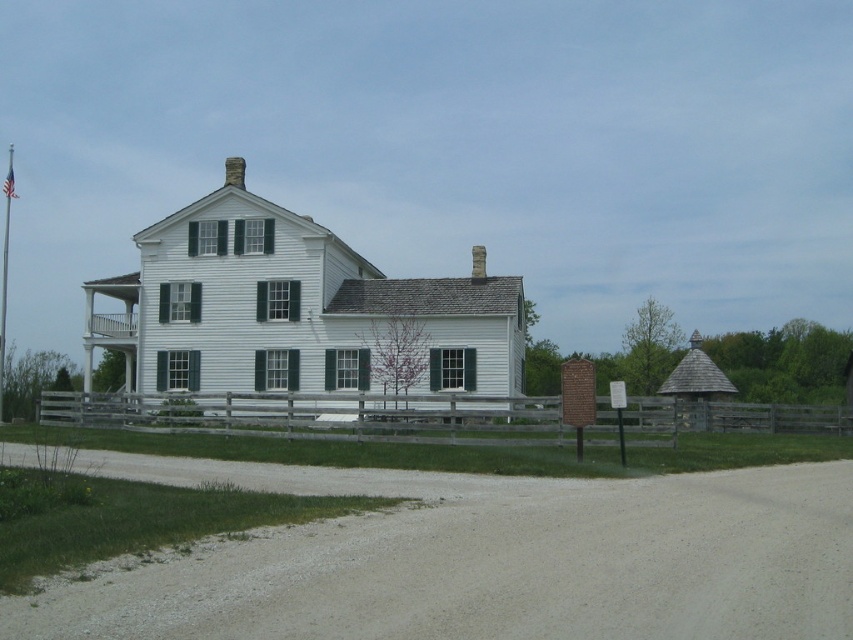
Question: Which point is farther from the camera taking this photo?

Choices:
 (A) (358, 628)
 (B) (625, 412)

Answer: (B)

Question: Can you confirm if gray gravel dirt track at lower center is smaller than wooden at center?

Choices:
 (A) no
 (B) yes

Answer: (B)

Question: Does gray gravel dirt track at lower center appear on the left side of wooden at center?

Choices:
 (A) no
 (B) yes

Answer: (B)

Question: Does gray gravel dirt track at lower center appear over wooden at center?

Choices:
 (A) yes
 (B) no

Answer: (A)